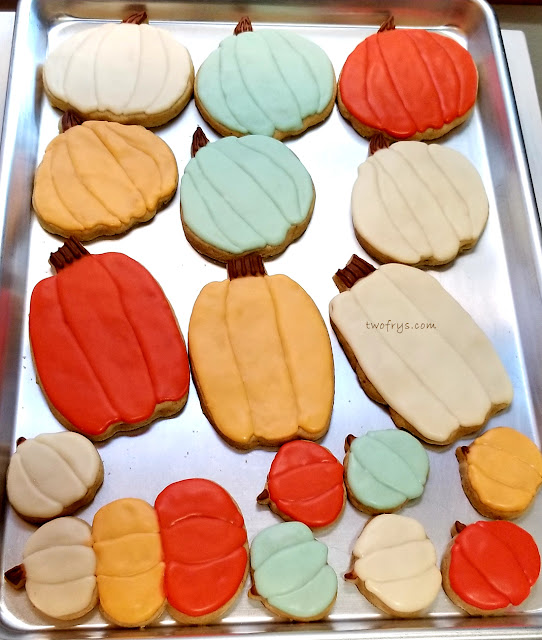
The image size is (542, 640). In order to click on counter in this screenshot , I will do `click(517, 54)`, `click(530, 104)`, `click(7, 28)`.